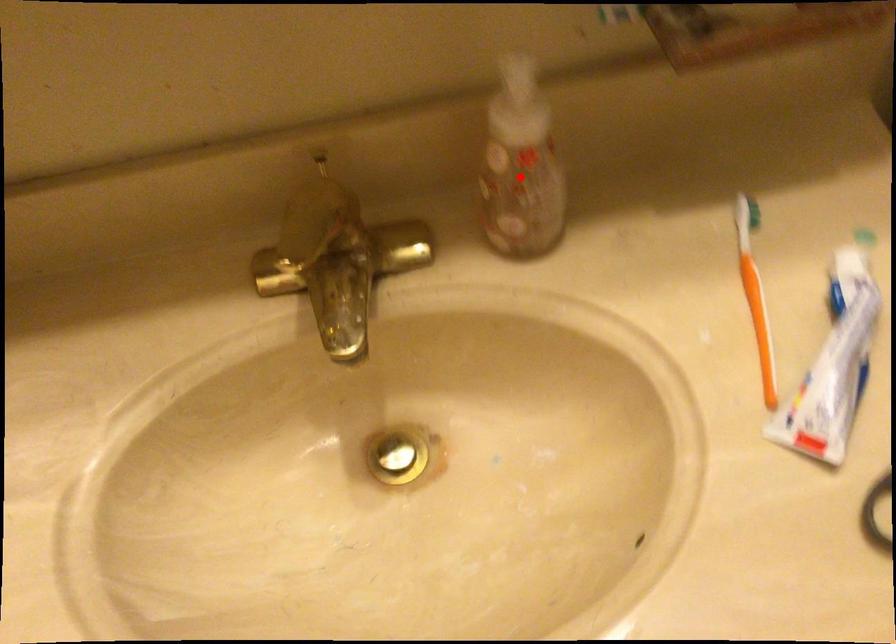
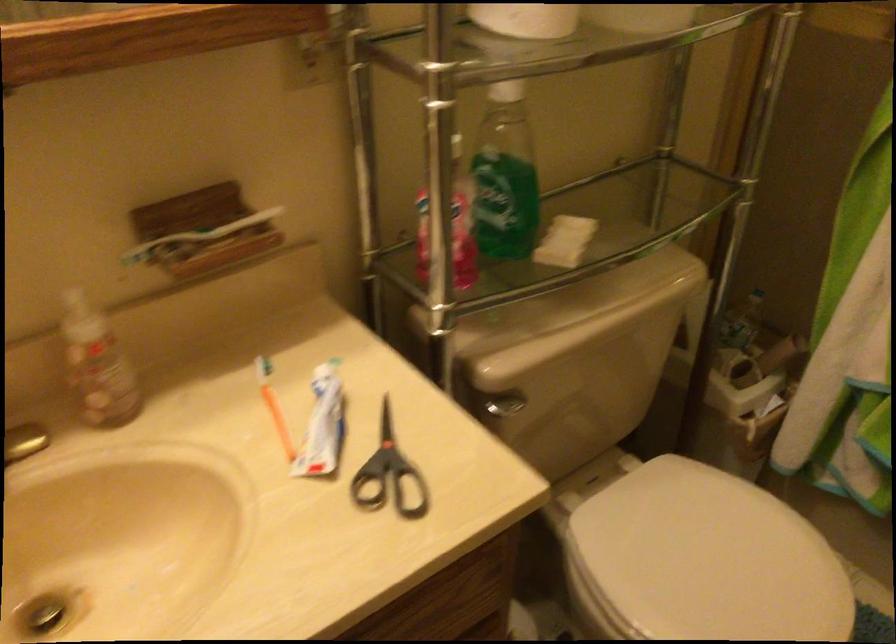
Question: I am providing you with two images of the same scene from different viewpoints. Given a red point in image1, look at the same physical point in image2. Is it:

Choices:
 (A) Closer to the viewpoint
 (B) Farther from the viewpoint

Answer: (B)